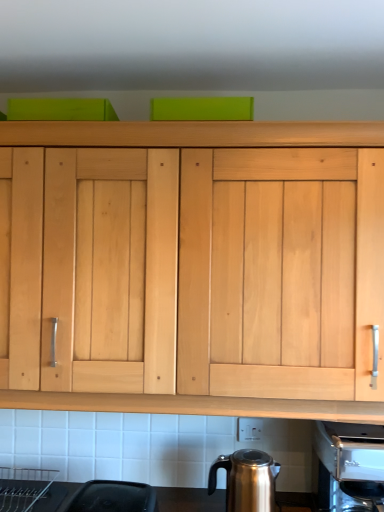
What do you see at coordinates (348, 466) in the screenshot?
I see `satin silver coffee machine at lower right` at bounding box center [348, 466].

This screenshot has width=384, height=512. What are the coordinates of `satin silver coffee machine at lower right` in the screenshot? It's located at (348, 466).

Measure the distance between point (229, 469) and camera.

Point (229, 469) and camera are 1.50 meters apart.

Find the location of a particular element. The width and height of the screenshot is (384, 512). shiny metallic kettle at lower center is located at coordinates (247, 480).

What is the approximate height of shiny metallic kettle at lower center?

9.58 inches.

This screenshot has height=512, width=384. Describe the element at coordinates (247, 480) in the screenshot. I see `shiny metallic kettle at lower center` at that location.

I want to click on satin silver coffee machine at lower right, so click(348, 466).

Does shiny metallic kettle at lower center appear on the left side of satin silver coffee machine at lower right?

Yes, shiny metallic kettle at lower center is to the left of satin silver coffee machine at lower right.

Considering the positions of objects shiny metallic kettle at lower center and satin silver coffee machine at lower right in the image provided, who is in front, shiny metallic kettle at lower center or satin silver coffee machine at lower right?

satin silver coffee machine at lower right is closer to the camera.

Is point (236, 452) closer to camera compared to point (340, 490)?

Yes, point (236, 452) is in front of point (340, 490).

From the image's perspective, is shiny metallic kettle at lower center on satin silver coffee machine at lower right?

Incorrect, from the image's perspective, shiny metallic kettle at lower center is lower than satin silver coffee machine at lower right.

From a real-world perspective, does shiny metallic kettle at lower center stand above satin silver coffee machine at lower right?

No, from a real-world perspective, shiny metallic kettle at lower center is not above satin silver coffee machine at lower right.

Which object is thinner, shiny metallic kettle at lower center or satin silver coffee machine at lower right?

shiny metallic kettle at lower center is thinner.

Considering the sizes of shiny metallic kettle at lower center and satin silver coffee machine at lower right in the image, is shiny metallic kettle at lower center taller or shorter than satin silver coffee machine at lower right?

In the image, shiny metallic kettle at lower center appears to be shorter than satin silver coffee machine at lower right.

Can you confirm if shiny metallic kettle at lower center is smaller than satin silver coffee machine at lower right?

Correct, shiny metallic kettle at lower center occupies less space than satin silver coffee machine at lower right.

Is shiny metallic kettle at lower center situated inside satin silver coffee machine at lower right or outside?

shiny metallic kettle at lower center is not enclosed by satin silver coffee machine at lower right.

Is there a large distance between shiny metallic kettle at lower center and satin silver coffee machine at lower right?

No.

Does shiny metallic kettle at lower center turn towards satin silver coffee machine at lower right?

No, shiny metallic kettle at lower center is not aimed at satin silver coffee machine at lower right.

How many degrees apart are the facing directions of shiny metallic kettle at lower center and satin silver coffee machine at lower right?

0.00416 degrees.

How much distance is there between shiny metallic kettle at lower center and satin silver coffee machine at lower right?

shiny metallic kettle at lower center is 13.06 inches away from satin silver coffee machine at lower right.

You are a GUI agent. You are given a task and a screenshot of the screen. Output one action in this format:
    pyautogui.click(x=<x>, y=<y>)
    Task: Click on the kitchen appliance that is under the satin silver coffee machine at lower right (from a real-world perspective)
    Image resolution: width=384 pixels, height=512 pixels.
    Given the screenshot: What is the action you would take?
    pyautogui.click(x=247, y=480)

Is satin silver coffee machine at lower right at the right side of shiny metallic kettle at lower center?

Indeed, satin silver coffee machine at lower right is positioned on the right side of shiny metallic kettle at lower center.

Relative to shiny metallic kettle at lower center, is satin silver coffee machine at lower right in front or behind?

In the image, satin silver coffee machine at lower right appears in front of shiny metallic kettle at lower center.

Is point (333, 463) in front of point (239, 488)?

No, (333, 463) is further to viewer.

From the image's perspective, is satin silver coffee machine at lower right located beneath shiny metallic kettle at lower center?

No, from the image's perspective, satin silver coffee machine at lower right is not below shiny metallic kettle at lower center.

From a real-world perspective, is satin silver coffee machine at lower right physically below shiny metallic kettle at lower center?

No, from a real-world perspective, satin silver coffee machine at lower right is not below shiny metallic kettle at lower center.

Which of these two, satin silver coffee machine at lower right or shiny metallic kettle at lower center, is thinner?

shiny metallic kettle at lower center is thinner.

Which of these two, satin silver coffee machine at lower right or shiny metallic kettle at lower center, stands shorter?

Standing shorter between the two is shiny metallic kettle at lower center.

Based on their sizes in the image, would you say satin silver coffee machine at lower right is bigger or smaller than shiny metallic kettle at lower center?

satin silver coffee machine at lower right is bigger than shiny metallic kettle at lower center.

Would you say satin silver coffee machine at lower right is inside or outside shiny metallic kettle at lower center?

satin silver coffee machine at lower right cannot be found inside shiny metallic kettle at lower center.

Is satin silver coffee machine at lower right next to shiny metallic kettle at lower center and touching it?

No.

Is satin silver coffee machine at lower right aimed at shiny metallic kettle at lower center?

No, satin silver coffee machine at lower right is not facing towards shiny metallic kettle at lower center.

How different are the orientations of satin silver coffee machine at lower right and shiny metallic kettle at lower center in degrees?

The facing directions of satin silver coffee machine at lower right and shiny metallic kettle at lower center are 0.00416 degrees apart.

Measure the distance from satin silver coffee machine at lower right to shiny metallic kettle at lower center.

satin silver coffee machine at lower right and shiny metallic kettle at lower center are 13.06 inches apart.

I want to click on coffee machine lying in front of the shiny metallic kettle at lower center, so click(348, 466).

Find the location of `kitchen appliance below the satin silver coffee machine at lower right (from the image's perspective)`. kitchen appliance below the satin silver coffee machine at lower right (from the image's perspective) is located at coordinates (247, 480).

Find the location of `kitchen appliance on the left of satin silver coffee machine at lower right`. kitchen appliance on the left of satin silver coffee machine at lower right is located at coordinates (247, 480).